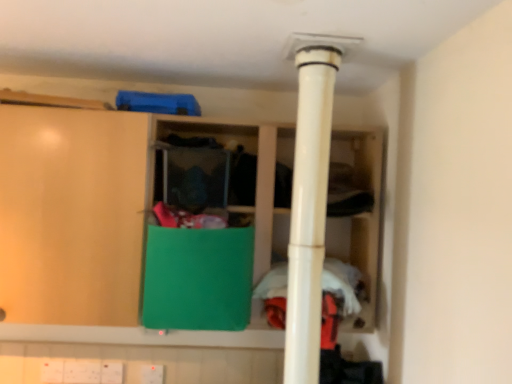
Find the location of a particular element. green fabric at center is located at coordinates (106, 224).

What do you see at coordinates (106, 224) in the screenshot? I see `green fabric at center` at bounding box center [106, 224].

Describe the element at coordinates (342, 284) in the screenshot. I see `white fabric at center` at that location.

This screenshot has width=512, height=384. What are the coordinates of `green fabric at center` in the screenshot? It's located at point(106,224).

Based on their positions, is green fabric at center located to the left or right of green matte cabinet at center?

In the image, green fabric at center appears on the left side of green matte cabinet at center.

From the image's perspective, does green fabric at center appear higher than green matte cabinet at center?

Correct, green fabric at center appears higher than green matte cabinet at center in the image.

From a real-world perspective, which is physically below, green fabric at center or green matte cabinet at center?

From a 3D spatial view, green matte cabinet at center is below.

Considering the positions of points (343, 251) and (154, 242), is point (343, 251) farther from camera compared to point (154, 242)?

That is True.

Is green matte cabinet at center to the left or to the right of white plastic pipe at center in the image?

Clearly, green matte cabinet at center is on the left of white plastic pipe at center in the image.

Is green matte cabinet at center oriented towards white plastic pipe at center?

No, green matte cabinet at center is not turned towards white plastic pipe at center.

From a real-world perspective, is green matte cabinet at center above or below white plastic pipe at center?

In terms of real-world spatial position, green matte cabinet at center is below white plastic pipe at center.

Consider the image. From the image's perspective, does green matte cabinet at center appear higher than white plastic pipe at center?

Actually, green matte cabinet at center appears below white plastic pipe at center in the image.

Does point (305, 358) lie behind point (344, 293)?

No, (305, 358) is closer to viewer.

From the image's perspective, which is below, white plastic pipe at center or white fabric at center?

white fabric at center.

Which object is thinner, white plastic pipe at center or white fabric at center?

Thinner between the two is white plastic pipe at center.

Looking at this image, from a real-world perspective, which is physically below, green matte cabinet at center or green fabric at center?

green matte cabinet at center is physically lower.

Which object is thinner, green matte cabinet at center or green fabric at center?

Thinner between the two is green fabric at center.

Is green matte cabinet at center in contact with green fabric at center?

No, green matte cabinet at center is not beside green fabric at center.

Which object is positioned more to the right, green matte cabinet at center or green fabric at center?

From the viewer's perspective, green matte cabinet at center appears more on the right side.

Which point is more distant from viewer, (x=347, y=147) or (x=311, y=160)?

The point (x=347, y=147) is farther from the camera.

Consider the image. Considering the relative sizes of green fabric at center and white plastic pipe at center in the image provided, is green fabric at center shorter than white plastic pipe at center?

Indeed, green fabric at center has a lesser height compared to white plastic pipe at center.

Considering the positions of objects green fabric at center and white plastic pipe at center in the image provided, who is in front, green fabric at center or white plastic pipe at center?

white plastic pipe at center is more forward.

Can you confirm if green fabric at center is thinner than white plastic pipe at center?

No, green fabric at center is not thinner than white plastic pipe at center.

From a real-world perspective, is white fabric at center physically located above or below green fabric at center?

Clearly, from a real-world perspective, white fabric at center is below green fabric at center.

Does point (265, 278) come in front of point (36, 325)?

That is False.

Is white fabric at center wider or thinner than green fabric at center?

white fabric at center is thinner than green fabric at center.

Consider the image. How many degrees apart are the facing directions of white fabric at center and green fabric at center?

0.209 degrees.

What's the angular difference between white fabric at center and green matte cabinet at center's facing directions?

They differ by 0.000577 degrees in their facing directions.

Does point (326, 259) come closer to viewer compared to point (216, 262)?

No, (326, 259) is further to viewer.

Is white fabric at center in front of or behind green matte cabinet at center in the image?

white fabric at center is behind green matte cabinet at center.

Considering the sizes of white fabric at center and green matte cabinet at center in the image, is white fabric at center bigger or smaller than green matte cabinet at center?

In the image, white fabric at center appears to be smaller than green matte cabinet at center.

In order to click on cabinetry below the green fabric at center (from the image's perspective) in this screenshot , I will do `click(198, 278)`.

I want to click on water heater on the right of green matte cabinet at center, so click(x=310, y=197).

Considering their positions, is white fabric at center positioned further to white plastic pipe at center than green matte cabinet at center?

Based on the image, white fabric at center appears to be further to white plastic pipe at center.

Considering their positions, is white fabric at center positioned further to green matte cabinet at center than white plastic pipe at center?

white plastic pipe at center is further to green matte cabinet at center.

Which object lies nearer to the anchor point green matte cabinet at center, green fabric at center or white fabric at center?

green fabric at center lies closer to green matte cabinet at center than the other object.

Looking at the image, which one is located further to green matte cabinet at center, white plastic pipe at center or white fabric at center?

Based on the image, white plastic pipe at center appears to be further to green matte cabinet at center.

Based on the photo, based on their spatial positions, is white plastic pipe at center or green fabric at center closer to white fabric at center?

white plastic pipe at center.

In the scene shown: Estimate the real-world distances between objects in this image. Which object is further from white fabric at center, green matte cabinet at center or white plastic pipe at center?

Based on the image, white plastic pipe at center appears to be further to white fabric at center.

Considering their positions, is white plastic pipe at center positioned further to white fabric at center than green matte cabinet at center?

white plastic pipe at center is further to white fabric at center.

Looking at the image, which one is located further to green fabric at center, green matte cabinet at center or white plastic pipe at center?

Among the two, white plastic pipe at center is located further to green fabric at center.

This screenshot has height=384, width=512. Identify the location of cabinetry situated between green fabric at center and white plastic pipe at center from left to right. (198, 278).

Where is `cabinetry between green fabric at center and white fabric at center in the horizontal direction`? This screenshot has width=512, height=384. cabinetry between green fabric at center and white fabric at center in the horizontal direction is located at coordinates (198, 278).

The width and height of the screenshot is (512, 384). What are the coordinates of `water heater between green matte cabinet at center and white fabric at center in the horizontal direction` in the screenshot? It's located at (310, 197).

Find the location of a particular element. This screenshot has width=512, height=384. water heater located between green fabric at center and white fabric at center in the left-right direction is located at coordinates (310, 197).